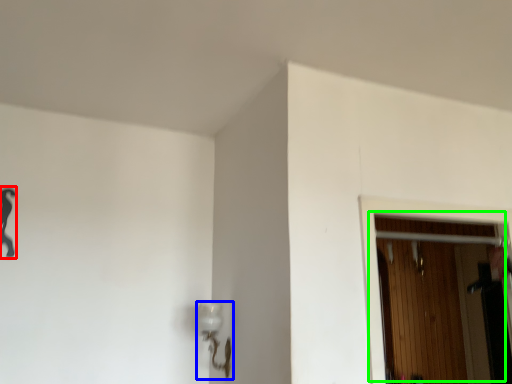
Question: Which object is the farthest from woman (highlighted by a red box)? Choose among these: lamp (highlighted by a blue box) or door (highlighted by a green box).

Choices:
 (A) lamp
 (B) door

Answer: (B)